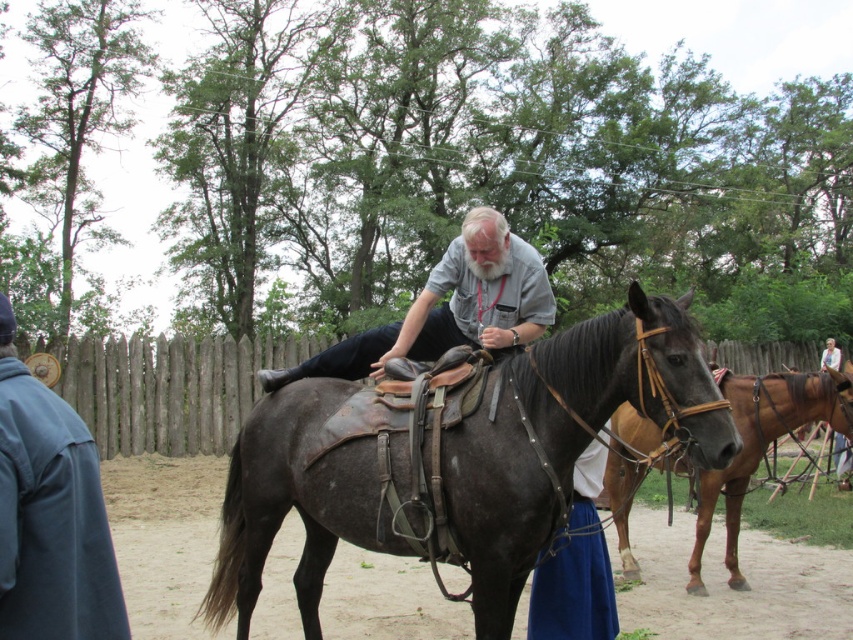
You are a photographer positioned in the middle of the fenced area. You notice two jackets in the scene. The blue fabric jacket at left and the light brown leather jacket at center. Which jacket is higher in the image?

The blue fabric jacket at left is above the light brown leather jacket at center in the image.

You are a photographer positioned at the origin point in the scene. You need to capture a photo of the dark brown leather horse at center. According to the coordinates provided, in which direction should you move to frame the horse properly?

The dark brown leather horse at center is located at point 0.683 in the x and 0.666 in the y coordinates. Since the origin is at the bottom left corner, you should move to the right and slightly upwards to frame the horse properly.